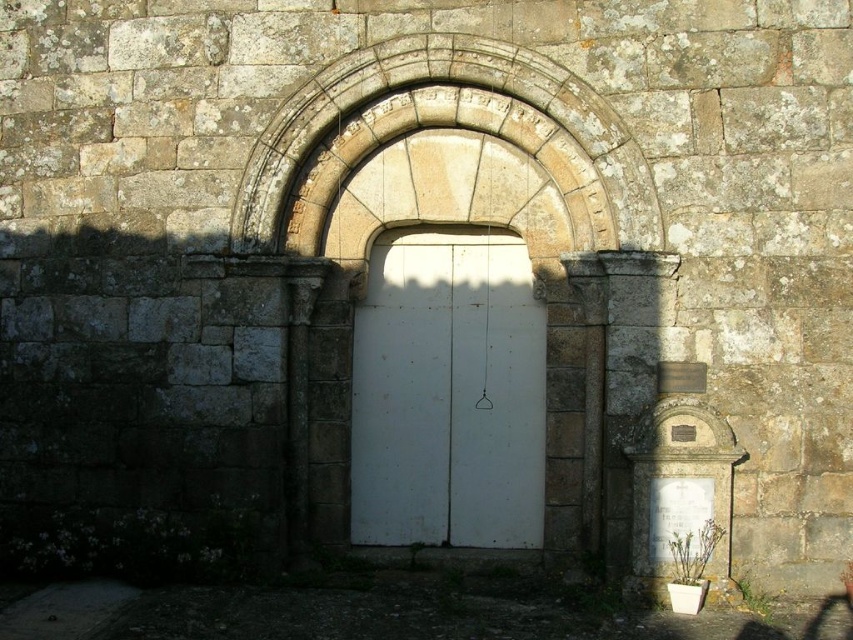
Question: Among these objects, which one is nearest to the camera?

Choices:
 (A) white matte door at center
 (B) stone textured archway at center

Answer: (B)

Question: Does white matte door at center have a greater width compared to stone textured archway at center?

Choices:
 (A) yes
 (B) no

Answer: (B)

Question: Where is white matte door at center located in relation to stone textured archway at center in the image?

Choices:
 (A) left
 (B) right

Answer: (A)

Question: Does white matte door at center appear under stone textured archway at center?

Choices:
 (A) no
 (B) yes

Answer: (B)